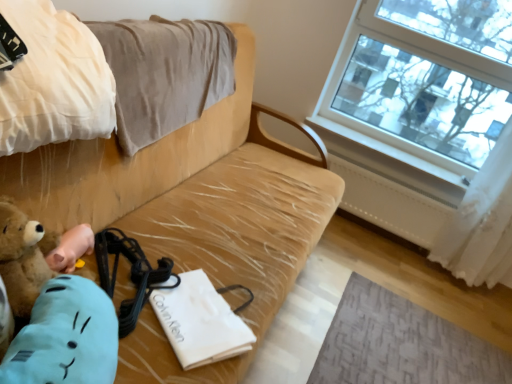
You are a GUI agent. You are given a task and a screenshot of the screen. Output one action in this format:
    pyautogui.click(x=<x>, y=<y>)
    Task: Click on the free space to the back side of textured gray mat at lower right
    This screenshot has width=512, height=384.
    Given the screenshot: What is the action you would take?
    pyautogui.click(x=405, y=271)